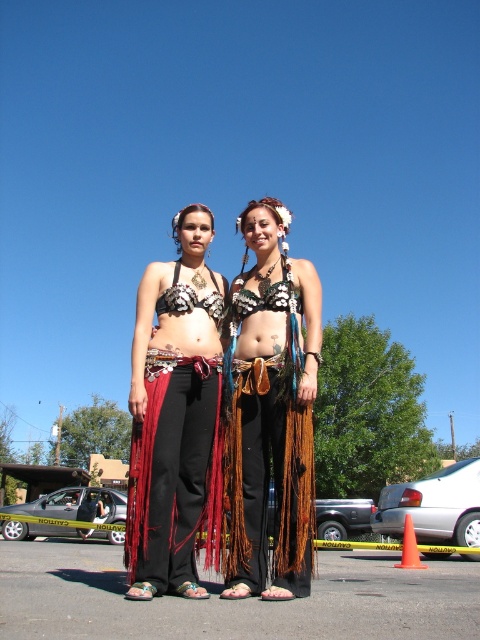
Question: Among these points, which one is nearest to the camera?

Choices:
 (A) (240, 337)
 (B) (207, 296)

Answer: (A)

Question: Can you confirm if matte skin belly at center is positioned to the left of matte black bikini top at center?

Choices:
 (A) yes
 (B) no

Answer: (A)

Question: Which point is closer to the camera?

Choices:
 (A) (171, 346)
 (B) (252, 317)

Answer: (A)

Question: Where is metallic silver bikini top at center located in relation to matte black bikini top at center in the image?

Choices:
 (A) left
 (B) right

Answer: (B)

Question: Is brown leather belt at center thinner than matte black bikini top at center?

Choices:
 (A) yes
 (B) no

Answer: (A)

Question: Which point is closer to the camera taking this photo?

Choices:
 (A) (272, 323)
 (B) (243, 294)
 (C) (380, 586)

Answer: (A)